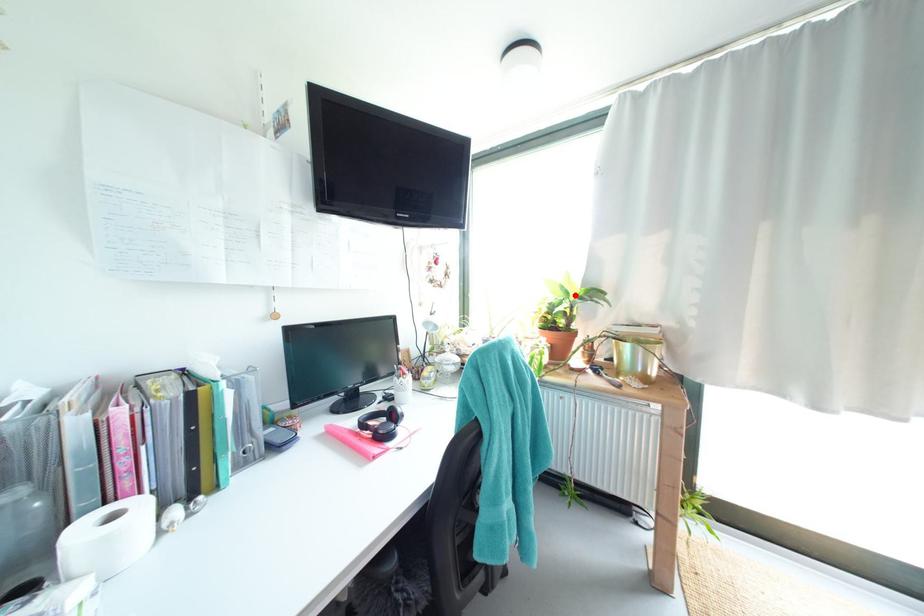
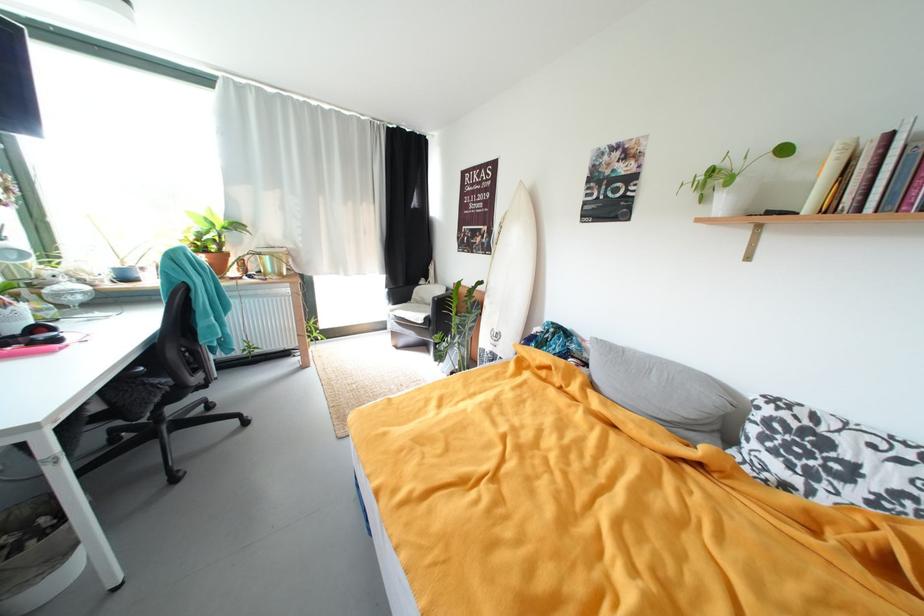
Where in the second image is the point corresponding to the highlighted location from the first image?

(221, 225)